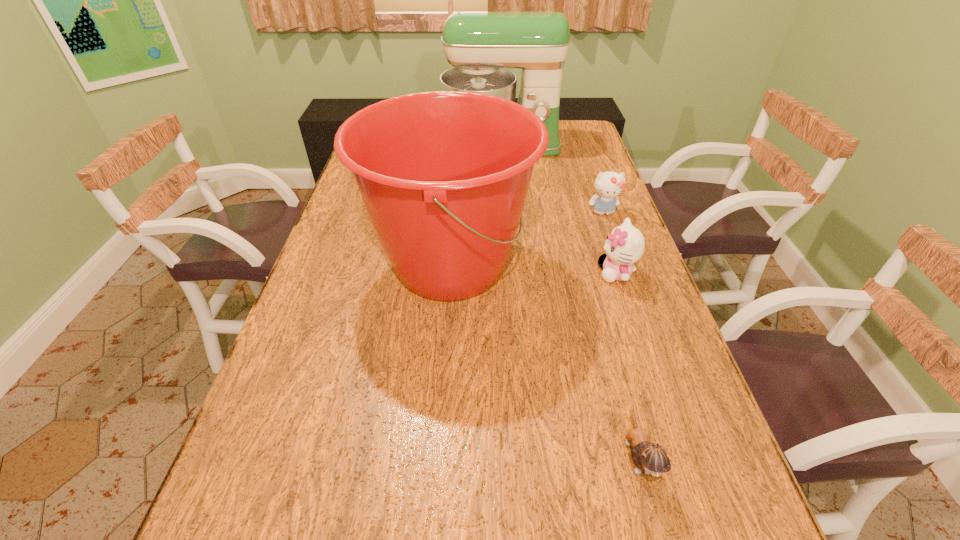
I want to click on object that is the fourth nearest to the farthest object, so click(x=651, y=458).

Where is `object that is the third closest to the second farthest kitten`? object that is the third closest to the second farthest kitten is located at coordinates (651, 458).

In order to click on kitten that stands as the second closest to the second tallest object in this screenshot , I will do `click(609, 185)`.

Locate which kitten is the third closest to the second tallest object. Please provide its 2D coordinates. Your answer should be formatted as a tuple, i.e. [(x, y)], where the tuple contains the x and y coordinates of a point satisfying the conditions above.

[(651, 458)]

The height and width of the screenshot is (540, 960). Identify the location of blank area in the image that satisfies the following two spatial constraints: 1. on the controls of the farthest object; 2. with the handle attached to the rim of the bucket. (511, 266).

Find the location of a particular element. Image resolution: width=960 pixels, height=540 pixels. free spot that satisfies the following two spatial constraints: 1. on the front-facing side of the farthest kitten; 2. with the handle attached to the rim of the fourth shortest object is located at coordinates (622, 266).

Where is `vacant space that satisfies the following two spatial constraints: 1. on the front-facing side of the farthest kitten; 2. with the handle attached to the rim of the bucket`? Image resolution: width=960 pixels, height=540 pixels. vacant space that satisfies the following two spatial constraints: 1. on the front-facing side of the farthest kitten; 2. with the handle attached to the rim of the bucket is located at coordinates (622, 266).

In order to click on free location that satisfies the following two spatial constraints: 1. on the front-facing side of the second nearest kitten; 2. on the front-facing side of the shortest kitten in this screenshot , I will do `click(677, 455)`.